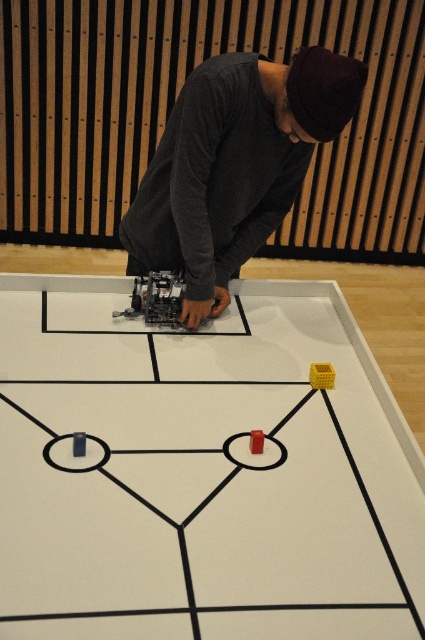
You are organizing a board game night and need to place the matte plastic board game at center and the dark gray sweater at center on a shelf. Which item should you place first to ensure both fit on the shelf?

The dark gray sweater at center should be placed first because the matte plastic board game at center is larger and will require more space, allowing the smaller sweater to fit alongside it.

You are a delivery robot that needs to place a package on the dark gray sweater at center without moving the matte plastic board game at center. Can you do it if your arm can reach 18 inches?

The matte plastic board game at center is 17.93 inches from the dark gray sweater at center. Since your arm can reach 18 inches, you can place the package on the dark gray sweater at center without moving the matte plastic board game at center because the distance is within your reach.